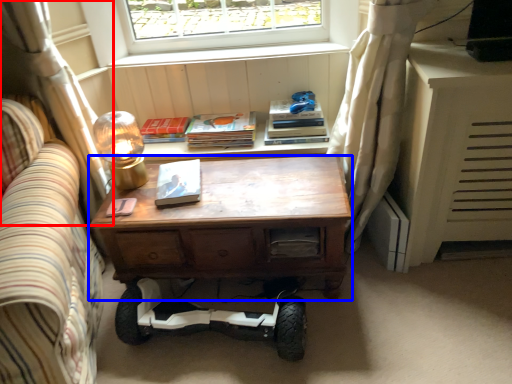
Question: Which object is closer to the camera taking this photo, curtain (highlighted by a red box) or desk (highlighted by a blue box)?

Choices:
 (A) curtain
 (B) desk

Answer: (A)